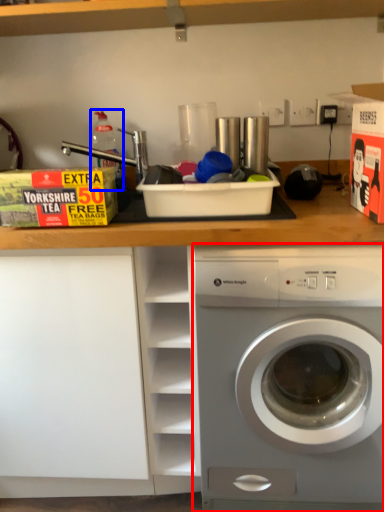
Question: Which object appears farthest to the camera in this image, washing machine (highlighted by a red box) or bottle (highlighted by a blue box)?

Choices:
 (A) washing machine
 (B) bottle

Answer: (B)